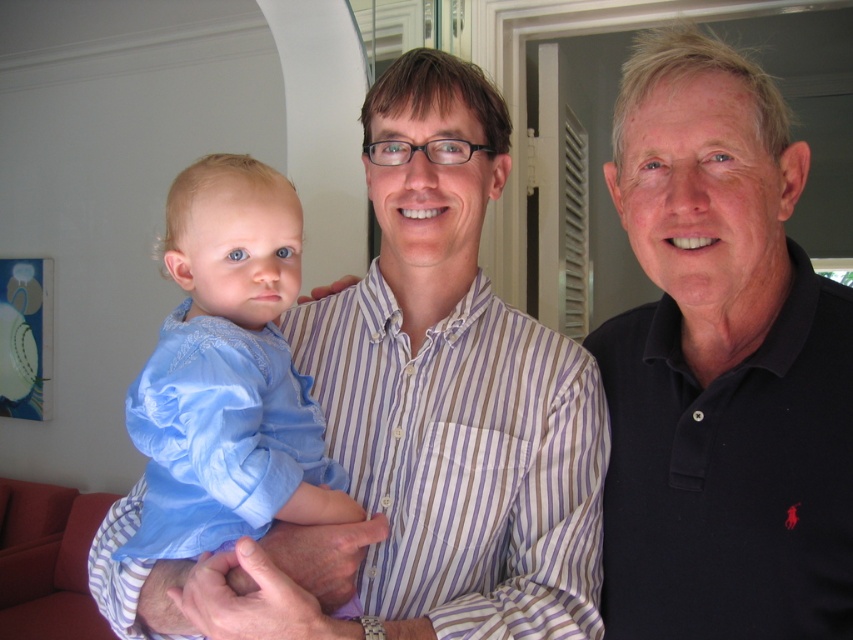
Does dark blue polo shirt at right have a lesser height compared to silky blue shirt at center?

No.

Who is shorter, dark blue polo shirt at right or silky blue shirt at center?

With less height is silky blue shirt at center.

This screenshot has width=853, height=640. What do you see at coordinates (721, 365) in the screenshot?
I see `dark blue polo shirt at right` at bounding box center [721, 365].

What are the coordinates of `dark blue polo shirt at right` in the screenshot? It's located at (721, 365).